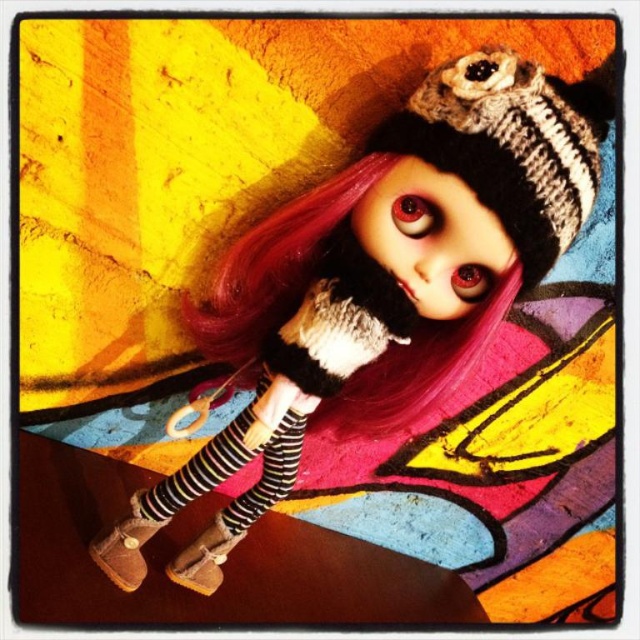
You are a photographer setting up a shoot in this scene. You need to place a small prop exactly where the suede boots at lower left are located. What are the coordinates where you should place the prop?

The suede boots at lower left are located at coordinates point [394,266], so you should place the prop there.